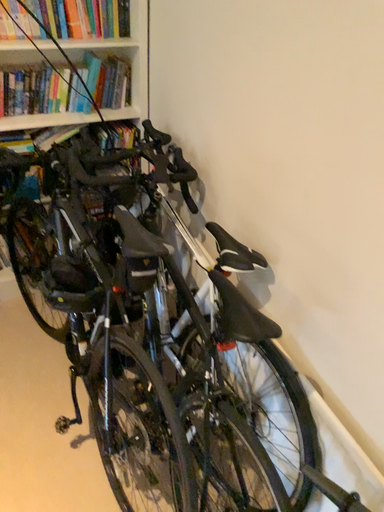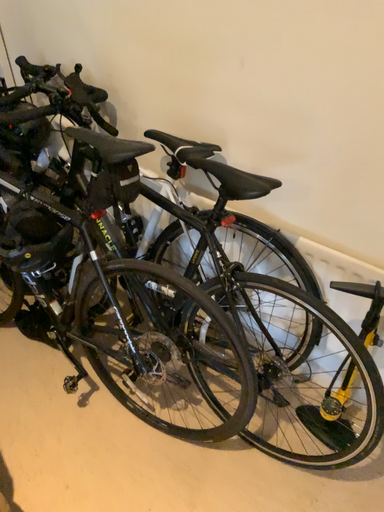
Question: Which way did the camera rotate in the video?

Choices:
 (A) rotated left
 (B) rotated right

Answer: (B)